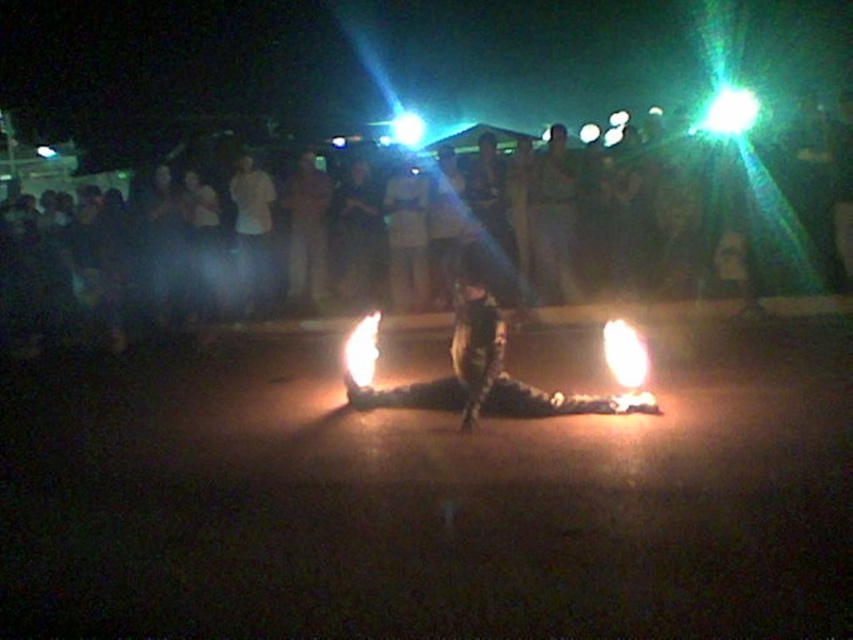
You are a photographer trying to capture the fire performance. You notice the dark clothing crowd at upper center and the bright orange flame at center. Which object is closer to the camera? Explain your reasoning based on the scene.

The dark clothing crowd at upper center is closer to the camera because they are positioned in front of the bright orange flame at center, as indicated by the description. In photography, objects in front of others in the scene would appear closer to the viewer or camera.